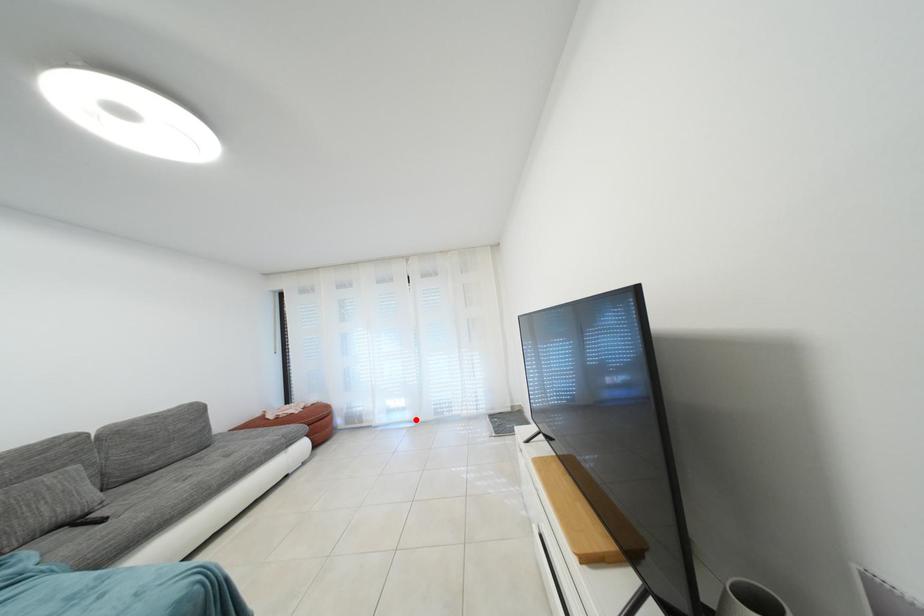
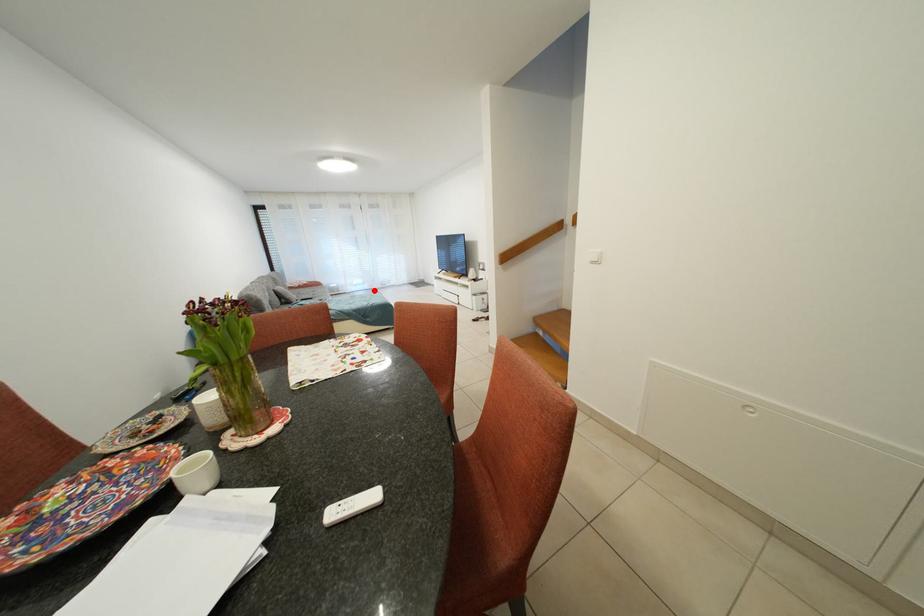
In the scene shown: I am providing you with two images of the same scene from different viewpoints. A red point is marked on the first image and another point is marked on the second image. Is the red point in image1 aligned with the point shown in image2?

Yes